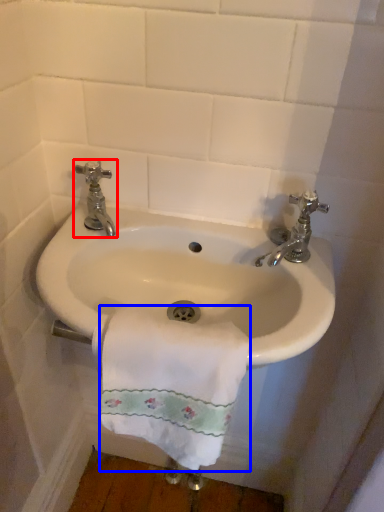
Question: Which of the following is the farthest to the observer, tap (highlighted by a red box) or towel/napkin (highlighted by a blue box)?

Choices:
 (A) tap
 (B) towel/napkin

Answer: (A)